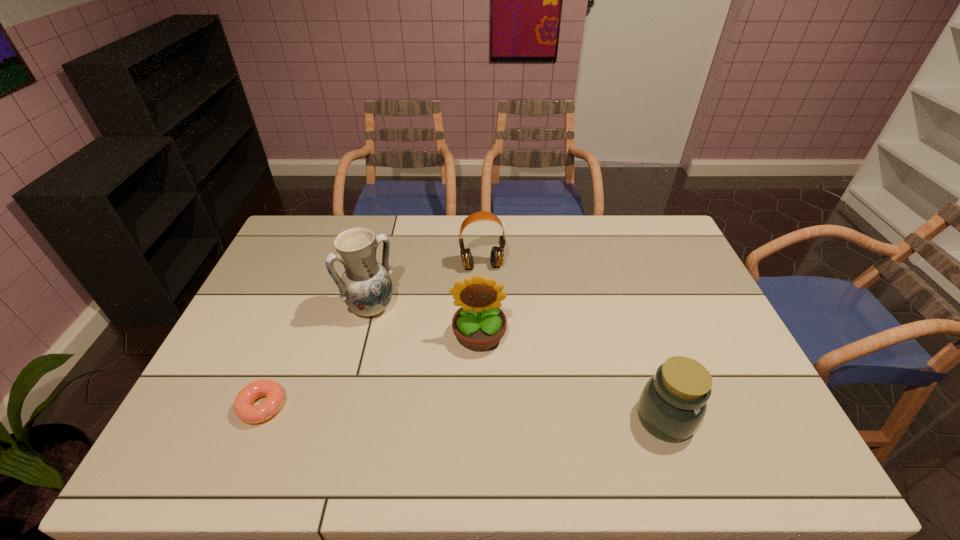
The height and width of the screenshot is (540, 960). I want to click on the leftmost object, so pos(243,406).

Where is `the shortest object`? the shortest object is located at coordinates (243, 406).

At what (x,y) coordinates should I click in order to perform the action: click on the rightmost object. Please return your answer as a coordinate pair (x, y). The image size is (960, 540). Looking at the image, I should click on (673, 402).

Where is `pottery`? pottery is located at coordinates (366, 287).

Identify the location of sunflower. (479, 324).

Identify the location of the farthest object. (497, 253).

Locate an element on the screen. This screenshot has width=960, height=540. vacant space positioned 0.260m on the back of the doughnut is located at coordinates (300, 314).

Find the location of `free point located 0.090m on the left of the rightmost object`. free point located 0.090m on the left of the rightmost object is located at coordinates [x=599, y=418].

Where is `vacant area located 0.300m on either side of the fourth object from right to left`? Image resolution: width=960 pixels, height=540 pixels. vacant area located 0.300m on either side of the fourth object from right to left is located at coordinates (444, 388).

Locate an element on the screen. vacant space positioned on either side of the fourth object from right to left is located at coordinates (422, 364).